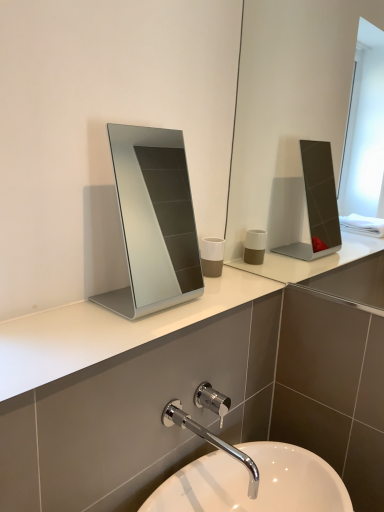
I want to click on silver metallic mirror at center, so click(x=154, y=221).

What do you see at coordinates (210, 440) in the screenshot?
I see `chrome metallic faucet at lower center` at bounding box center [210, 440].

This screenshot has width=384, height=512. Find the location of `white matte cup at center`. white matte cup at center is located at coordinates (212, 256).

Based on the photo, is chrome metallic faucet at lower center to the left of white matte cup at center from the viewer's perspective?

Correct, you'll find chrome metallic faucet at lower center to the left of white matte cup at center.

Considering the relative sizes of chrome metallic faucet at lower center and white matte cup at center in the image provided, is chrome metallic faucet at lower center wider than white matte cup at center?

Indeed, chrome metallic faucet at lower center has a greater width compared to white matte cup at center.

From the image's perspective, would you say chrome metallic faucet at lower center is shown under white matte cup at center?

Yes, from the image's perspective, chrome metallic faucet at lower center is below white matte cup at center.

From a real-world perspective, between white glossy sink at lower center and silver metallic mirror at center, who is vertically lower?

white glossy sink at lower center is physically lower.

This screenshot has height=512, width=384. I want to click on sink below the silver metallic mirror at center (from a real-world perspective), so click(x=252, y=482).

What's the angular difference between white glossy sink at lower center and silver metallic mirror at center's facing directions?

1.53 degrees separate the facing orientations of white glossy sink at lower center and silver metallic mirror at center.

Is white glossy sink at lower center inside the boundaries of silver metallic mirror at center, or outside?

white glossy sink at lower center exists outside the volume of silver metallic mirror at center.

From the image's perspective, relative to white glossy sink at lower center, is chrome metallic faucet at lower center above or below?

Based on their image positions, chrome metallic faucet at lower center is located above white glossy sink at lower center.

From the picture: Is chrome metallic faucet at lower center positioned far away from white glossy sink at lower center?

chrome metallic faucet at lower center is near white glossy sink at lower center, not far away.

Is chrome metallic faucet at lower center inside the boundaries of white glossy sink at lower center, or outside?

chrome metallic faucet at lower center is outside white glossy sink at lower center.

Visually, is silver metallic mirror at center positioned to the left or to the right of chrome metallic faucet at lower center?

In the image, silver metallic mirror at center appears on the left side of chrome metallic faucet at lower center.

Which is further, (144, 246) or (176, 410)?

The point (144, 246) is more distant.

Is silver metallic mirror at center taller than chrome metallic faucet at lower center?

Correct, silver metallic mirror at center is much taller as chrome metallic faucet at lower center.

Is silver metallic mirror at center with chrome metallic faucet at lower center?

No, silver metallic mirror at center is not making contact with chrome metallic faucet at lower center.

Is point (208, 266) closer or farther from the camera than point (167, 181)?

Point (208, 266) appears to be closer to the viewer than point (167, 181).

Could you tell me if white matte cup at center is turned towards silver metallic mirror at center?

No, white matte cup at center is not oriented towards silver metallic mirror at center.

Measure the distance from white matte cup at center to silver metallic mirror at center.

A distance of 2.22 meters exists between white matte cup at center and silver metallic mirror at center.

Looking at this image, from a real-world perspective, who is located higher, white matte cup at center or silver metallic mirror at center?

silver metallic mirror at center is physically above.

Considering the positions of objects chrome metallic faucet at lower center and silver metallic mirror at center in the image provided, who is in front, chrome metallic faucet at lower center or silver metallic mirror at center?

chrome metallic faucet at lower center is in front.

In terms of size, does chrome metallic faucet at lower center appear bigger or smaller than silver metallic mirror at center?

chrome metallic faucet at lower center is smaller than silver metallic mirror at center.

From the image's perspective, which one is positioned lower, chrome metallic faucet at lower center or silver metallic mirror at center?

chrome metallic faucet at lower center, from the image's perspective.

Where is `medicine cabinet lying behind the chrome metallic faucet at lower center`? This screenshot has height=512, width=384. medicine cabinet lying behind the chrome metallic faucet at lower center is located at coordinates (154, 221).

Does white matte cup at center have a smaller size compared to chrome metallic faucet at lower center?

Indeed, white matte cup at center has a smaller size compared to chrome metallic faucet at lower center.

At what (x,y) coordinates should I click in order to perform the action: click on tap located underneath the white matte cup at center (from a real-world perspective). Please return your answer as a coordinate pair (x, y). This screenshot has height=512, width=384. Looking at the image, I should click on point(210,440).

Is white matte cup at center facing away from chrome metallic faucet at lower center?

No.

Based on the photo, is white matte cup at center to the left or to the right of chrome metallic faucet at lower center in the image?

Based on their positions, white matte cup at center is located to the right of chrome metallic faucet at lower center.

Locate an element on the screen. tap lying below the white matte cup at center (from the image's perspective) is located at coordinates (210, 440).

The width and height of the screenshot is (384, 512). What are the coordinates of `sink directly beneath the silver metallic mirror at center (from a real-world perspective)` in the screenshot? It's located at (252, 482).

Based on the photo, estimate the real-world distances between objects in this image. Which object is further from silver metallic mirror at center, white glossy sink at lower center or white matte cup at center?

Based on the image, white glossy sink at lower center appears to be further to silver metallic mirror at center.

Estimate the real-world distances between objects in this image. Which object is further from silver metallic mirror at center, chrome metallic faucet at lower center or white matte cup at center?

Among the two, chrome metallic faucet at lower center is located further to silver metallic mirror at center.

Based on their spatial positions, is white glossy sink at lower center or white matte cup at center closer to chrome metallic faucet at lower center?

white glossy sink at lower center lies closer to chrome metallic faucet at lower center than the other object.

Looking at the image, which one is located closer to white glossy sink at lower center, chrome metallic faucet at lower center or silver metallic mirror at center?

chrome metallic faucet at lower center is closer to white glossy sink at lower center.

Based on their spatial positions, is white matte cup at center or chrome metallic faucet at lower center further from silver metallic mirror at center?

The object further to silver metallic mirror at center is chrome metallic faucet at lower center.

Considering their positions, is white matte cup at center positioned further to white glossy sink at lower center than chrome metallic faucet at lower center?

white matte cup at center is positioned further to the anchor white glossy sink at lower center.

When comparing their distances from chrome metallic faucet at lower center, does white matte cup at center or silver metallic mirror at center seem further?

silver metallic mirror at center.

When comparing their distances from white glossy sink at lower center, does white matte cup at center or silver metallic mirror at center seem further?

Based on the image, silver metallic mirror at center appears to be further to white glossy sink at lower center.

You are a GUI agent. You are given a task and a screenshot of the screen. Output one action in this format:
    pyautogui.click(x=<x>, y=<y>)
    Task: Click on the tap between white glossy sink at lower center and white matte cup at center along the z-axis
    
    Given the screenshot: What is the action you would take?
    pyautogui.click(x=210, y=440)

Image resolution: width=384 pixels, height=512 pixels. Find the location of `tap between silver metallic mirror at center and white glossy sink at lower center in the up-down direction`. tap between silver metallic mirror at center and white glossy sink at lower center in the up-down direction is located at coordinates (210, 440).

The width and height of the screenshot is (384, 512). Identify the location of toiletry between silver metallic mirror at center and white glossy sink at lower center from top to bottom. (212, 256).

This screenshot has width=384, height=512. Find the location of `toiletry between silver metallic mirror at center and chrome metallic faucet at lower center vertically`. toiletry between silver metallic mirror at center and chrome metallic faucet at lower center vertically is located at coordinates (212, 256).